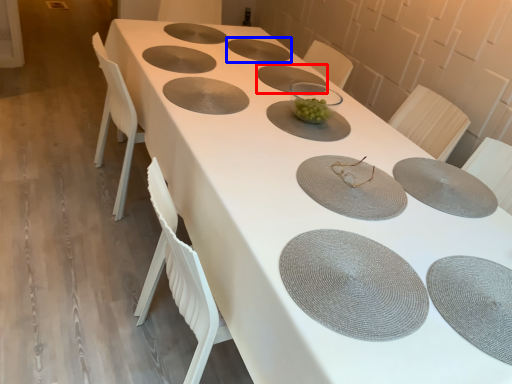
Question: Among these objects, which one is farthest to the camera, plate (highlighted by a red box) or tableware (highlighted by a blue box)?

Choices:
 (A) plate
 (B) tableware

Answer: (B)